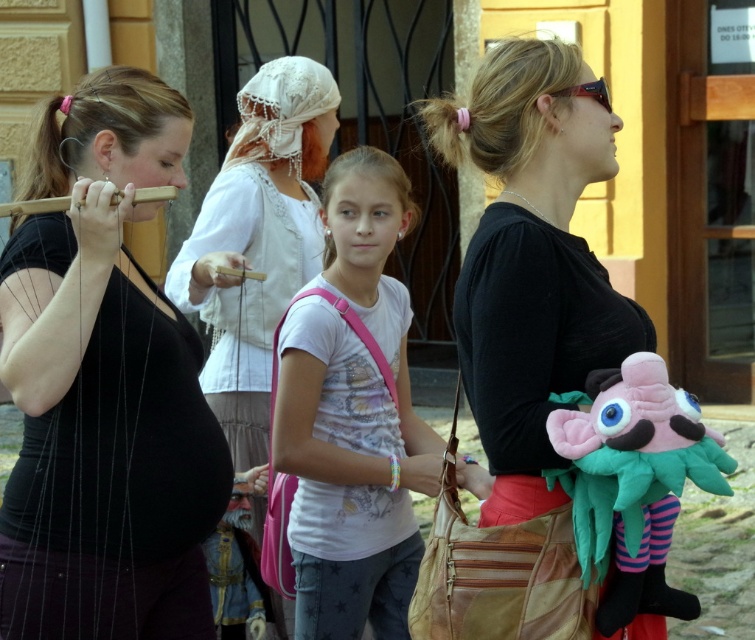
In the scene shown: What is the position of the point at coordinates [257,241] in the image?

The point at coordinates [257,241] is located on the white lace headscarf at center.

You are a performer in the puppet show and need to grab both the white lace headscarf at center and the wooden flute at center quickly. Can you reach both items without moving your position if your arms can extend 20 inches?

The distance between the white lace headscarf at center and the wooden flute at center is 20.44 inches. Since your arms can only extend 20 inches, you cannot reach both items without moving your position.

You are a street performer who needs to retrieve your wooden flute at left and pink plush toy at right for your next act. However, you can only move forward in a straight line from your current position. Which item will you reach first?

The pink plush toy at right is in front of the wooden flute at left, so you will reach the pink plush toy at right first since it is closer to you.